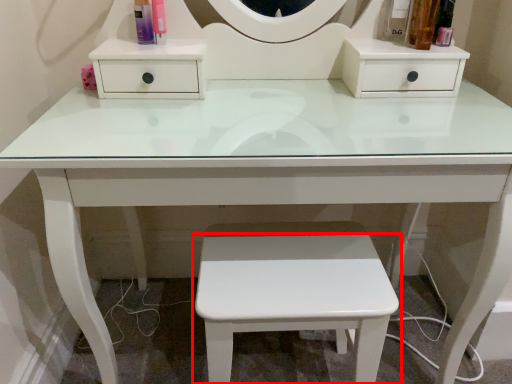
Question: Observing the image, what is the correct spatial positioning of stool (annotated by the red box) in reference to toiletry?

Choices:
 (A) right
 (B) left

Answer: (A)